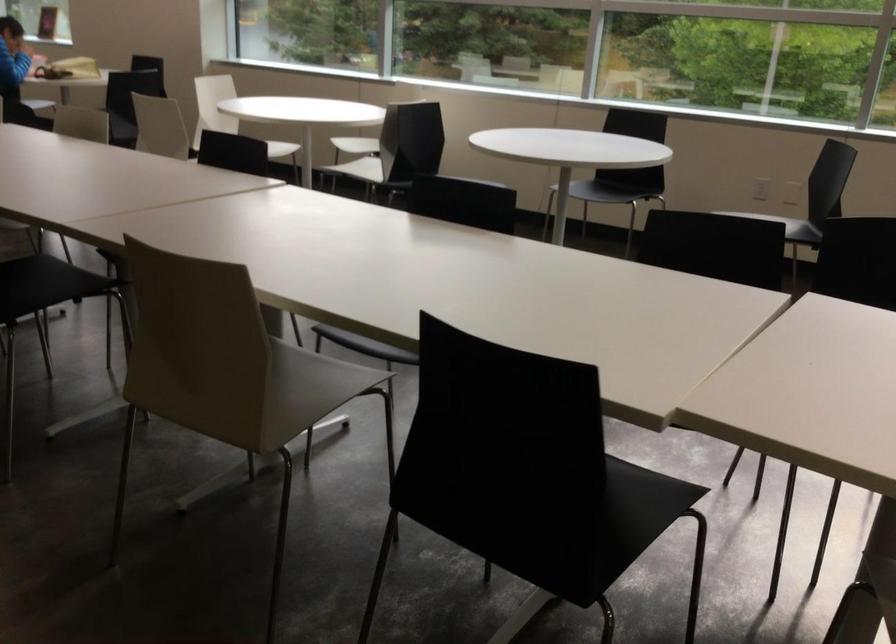
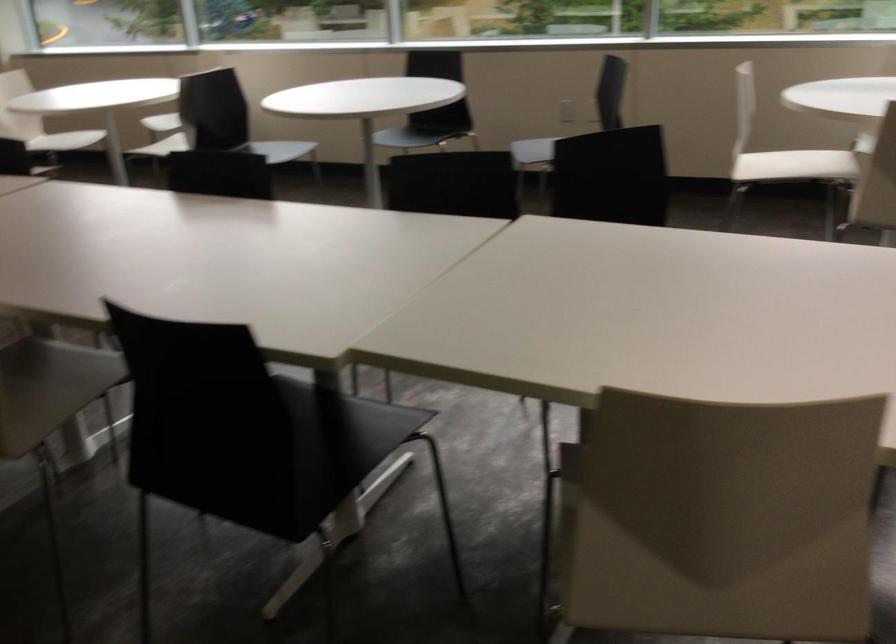
Question: The camera is either moving clockwise (left) or counter-clockwise (right) around the object. The first image is from the beginning of the video and the second image is from the end. Is the camera moving left or right when shooting the video?

Choices:
 (A) Left
 (B) Right

Answer: (A)